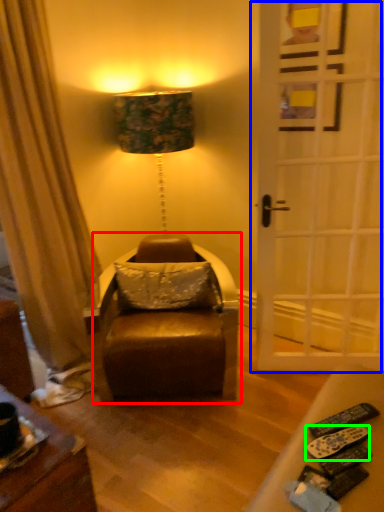
Question: Which object is positioned closest to swivel chair (highlighted by a red box)? Select from door (highlighted by a blue box) and remote control (highlighted by a green box).

Choices:
 (A) door
 (B) remote control

Answer: (A)